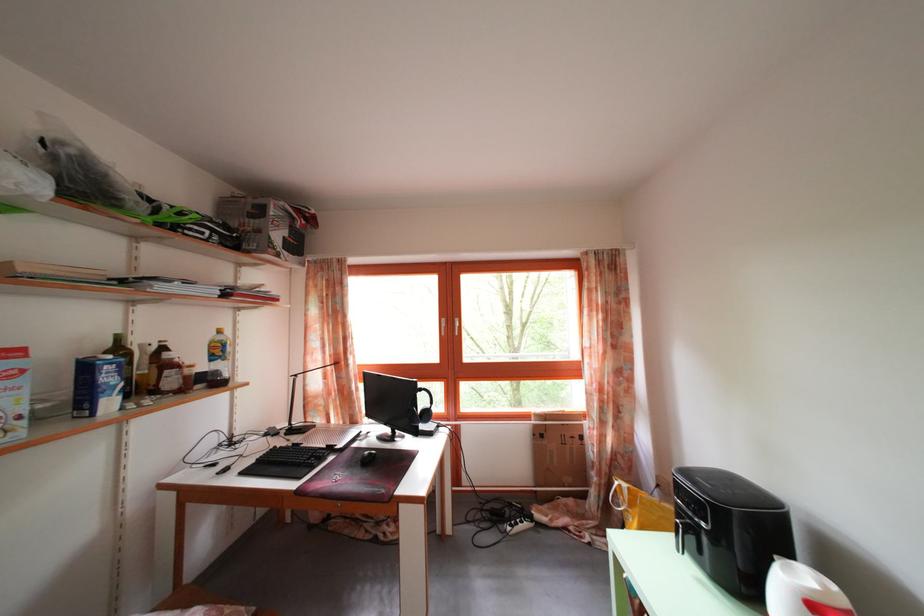
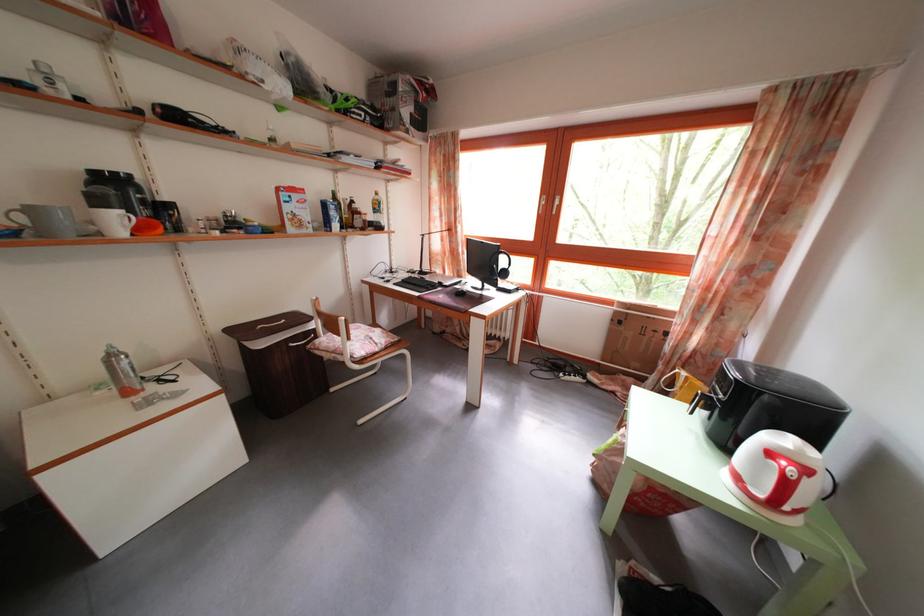
Find the pixel in the second image that matches [695,540] in the first image.

(713, 411)